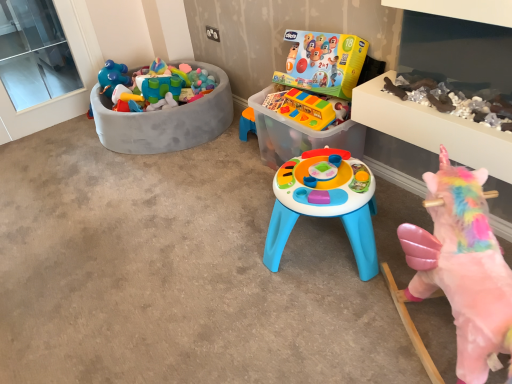
Question: Based on their sizes in the image, would you say rubberized yellow toy bus at center, which is counted as the 2th toy, starting from the left, is bigger or smaller than pink fabric unicorn at lower right, which appears as the first toy when viewed from the front?

Choices:
 (A) small
 (B) big

Answer: (A)

Question: Is rubberized yellow toy bus at center, placed as the third toy when sorted from back to front, taller or shorter than pink fabric unicorn at lower right, placed as the fourth toy when sorted from back to front?

Choices:
 (A) tall
 (B) short

Answer: (B)

Question: Which is farther from the transparent plastic toy box at center?

Choices:
 (A) rubberized yellow toy bus at center, the second toy positioned from the front
 (B) transparent glass window at upper left
 (C) pink fabric unicorn at lower right, which appears as the first toy when viewed from the front
 (D) plastic toy bin at left, the 4th toy in the front-to-back sequence
 (E) translucent plastic toy at center, arranged as the 3th toy when viewed from the front

Answer: (B)

Question: Which is farther from the rubberized yellow toy bus at center, the second toy positioned from the front?

Choices:
 (A) translucent plastic toy at center, marked as the 2th toy in a right-to-left arrangement
 (B) transparent glass window at upper left
 (C) transparent plastic toy box at center
 (D) pink fabric unicorn at lower right, which appears as the first toy when viewed from the front
 (E) plastic toy bin at left, which is the 1th toy from left to right

Answer: (B)